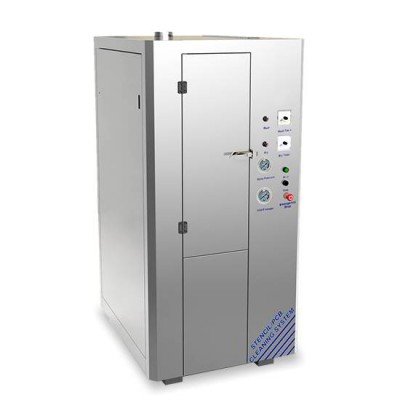
This screenshot has width=400, height=400. I want to click on appliance controls, so click(x=286, y=171), click(x=285, y=183), click(x=290, y=195), click(x=265, y=196), click(x=263, y=169), click(x=265, y=145), click(x=264, y=118), click(x=287, y=117), click(x=285, y=142).